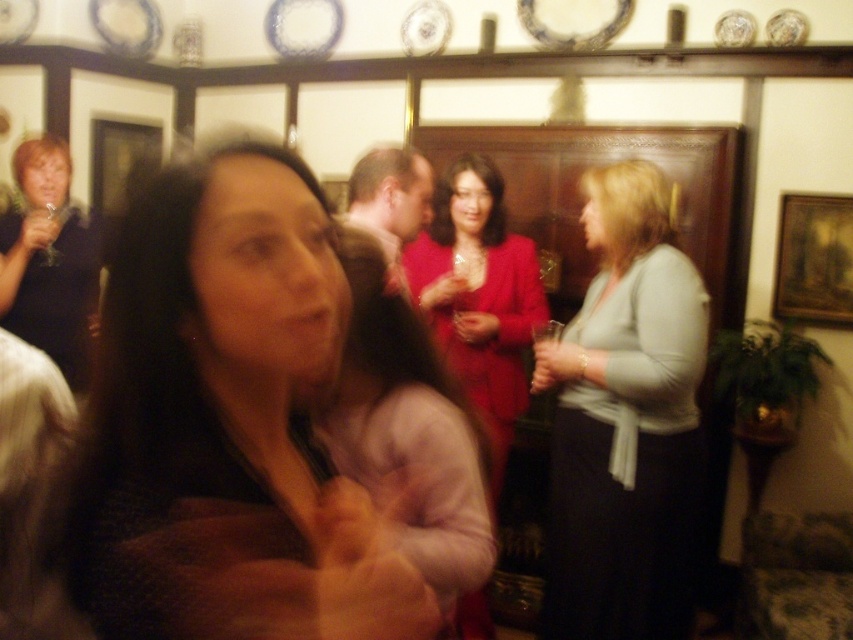
Which is below, dark brown hair at center or matte pink sweater at center?

matte pink sweater at center is below.

Image resolution: width=853 pixels, height=640 pixels. Describe the element at coordinates (219, 422) in the screenshot. I see `dark brown hair at center` at that location.

Locate an element on the screen. This screenshot has height=640, width=853. dark brown hair at center is located at coordinates (219, 422).

Is dark brown hair at center closer to the viewer compared to light gray sweater at center?

Yes, dark brown hair at center is closer to the viewer.

Is dark brown hair at center taller than light gray sweater at center?

No, dark brown hair at center is not taller than light gray sweater at center.

Between point (279, 474) and point (570, 616), which one is positioned behind?

Positioned behind is point (570, 616).

Identify the location of dark brown hair at center. (219, 422).

Is matte red dress at center below matte black dress at left?

Yes, matte red dress at center is below matte black dress at left.

Identify the location of matte red dress at center. The height and width of the screenshot is (640, 853). (479, 296).